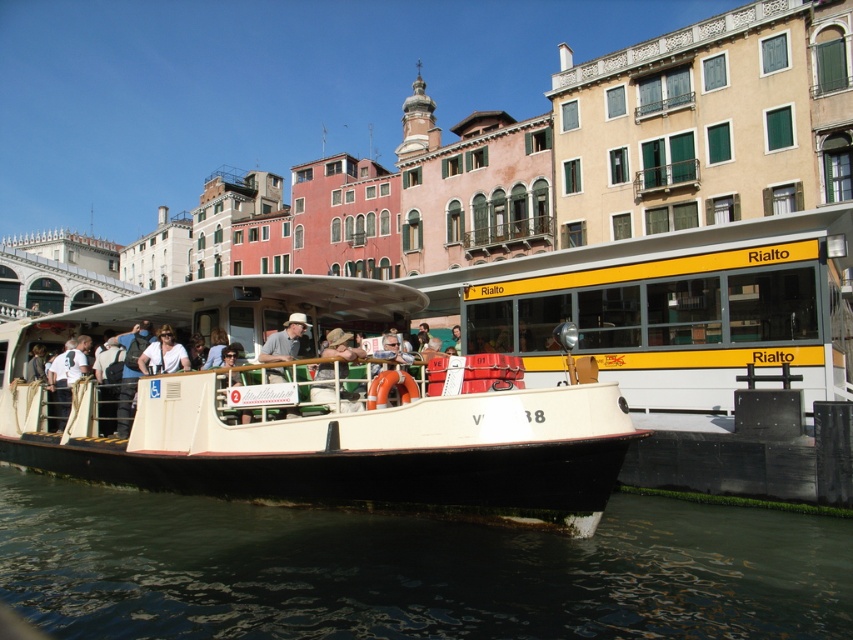
You are a tourist standing on the pier and looking at the greenish water at lower left and the khaki fabric hat at center. Which object is closer to the water surface?

The greenish water at lower left is located below the khaki fabric hat at center, so the greenish water at lower left is closer to the water surface than the khaki fabric hat at center.

You are a photographer standing on the pier and want to take a photo of the white matte boat at center and the matte white shirt at center. Which object should you focus on first to ensure it appears larger in the photo?

The white matte boat at center is closer to the viewer than the matte white shirt at center, so focusing on it first will make it appear larger in the photo.